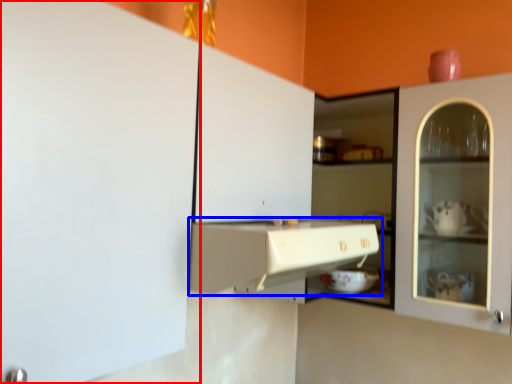
Question: Which of the following is the farthest to the observer, cabinetry (highlighted by a red box) or cabinetry (highlighted by a blue box)?

Choices:
 (A) cabinetry
 (B) cabinetry

Answer: (B)